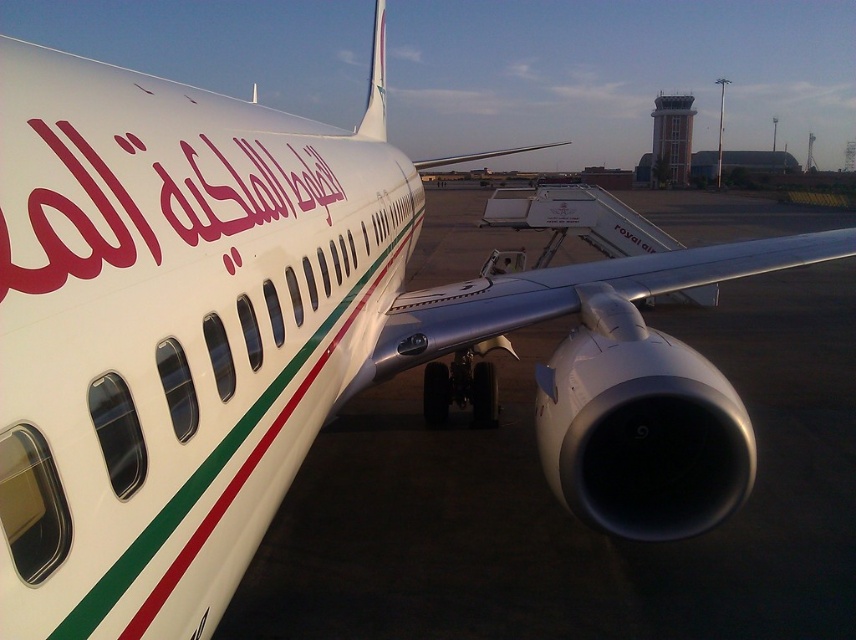
Is matte red text at center taller than white glossy tail at upper center?

Incorrect, matte red text at center's height is not larger of white glossy tail at upper center's.

This screenshot has width=856, height=640. Describe the element at coordinates (75, 220) in the screenshot. I see `matte red text at center` at that location.

Describe the element at coordinates (75, 220) in the screenshot. I see `matte red text at center` at that location.

Where is `matte red text at center`? The height and width of the screenshot is (640, 856). matte red text at center is located at coordinates (75, 220).